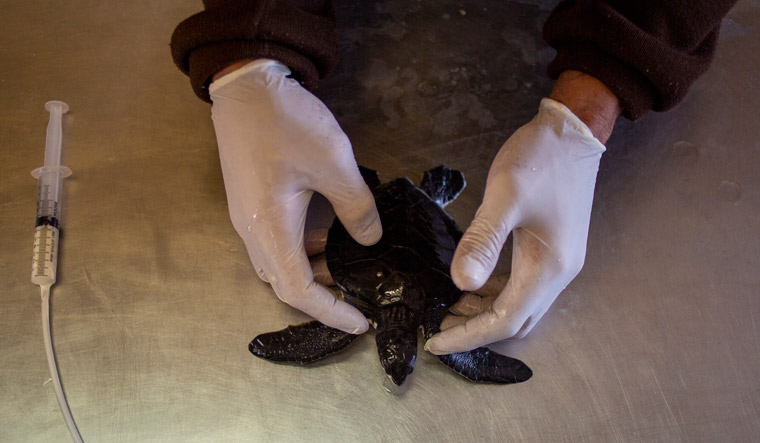
Where is `black plunger`? This screenshot has width=760, height=443. black plunger is located at coordinates (43, 219).